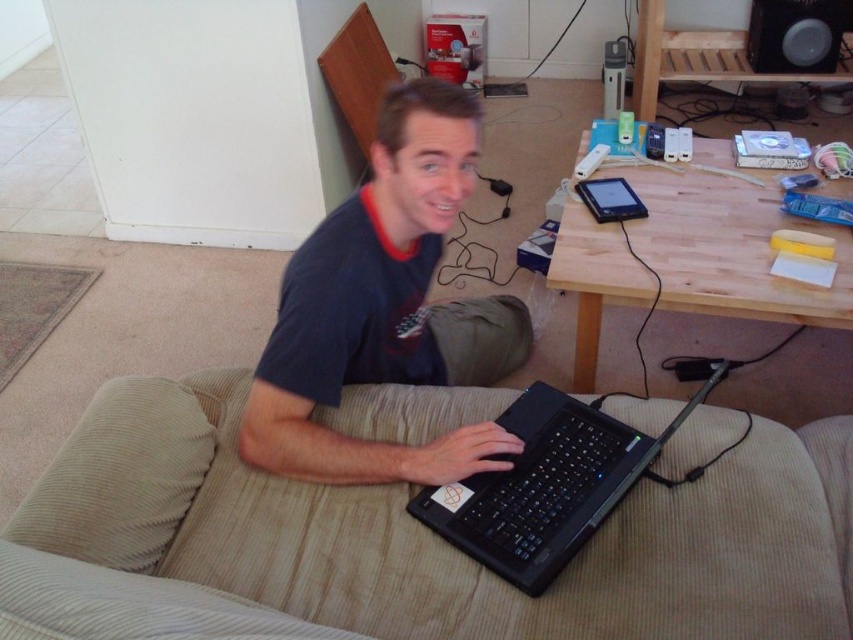
Question: Is matte black laptop at center further to camera compared to black plastic speaker at upper right?

Choices:
 (A) yes
 (B) no

Answer: (B)

Question: Which of the following is the farthest from the observer?

Choices:
 (A) (413, 157)
 (B) (537, 404)
 (C) (566, 589)
 (D) (762, 52)

Answer: (D)

Question: Is beige corduroy couch at center positioned before black plastic laptop at center?

Choices:
 (A) no
 (B) yes

Answer: (B)

Question: Which object is positioned farthest from the khaki fabric pants at lower center?

Choices:
 (A) black plastic speaker at upper right
 (B) black plastic laptop at center
 (C) beige corduroy couch at center

Answer: (A)

Question: Is beige corduroy couch at center below black plastic laptop at center?

Choices:
 (A) yes
 (B) no

Answer: (A)

Question: Which of the following is the closest to the observer?

Choices:
 (A) (520, 342)
 (B) (785, 19)
 (C) (538, 384)

Answer: (C)